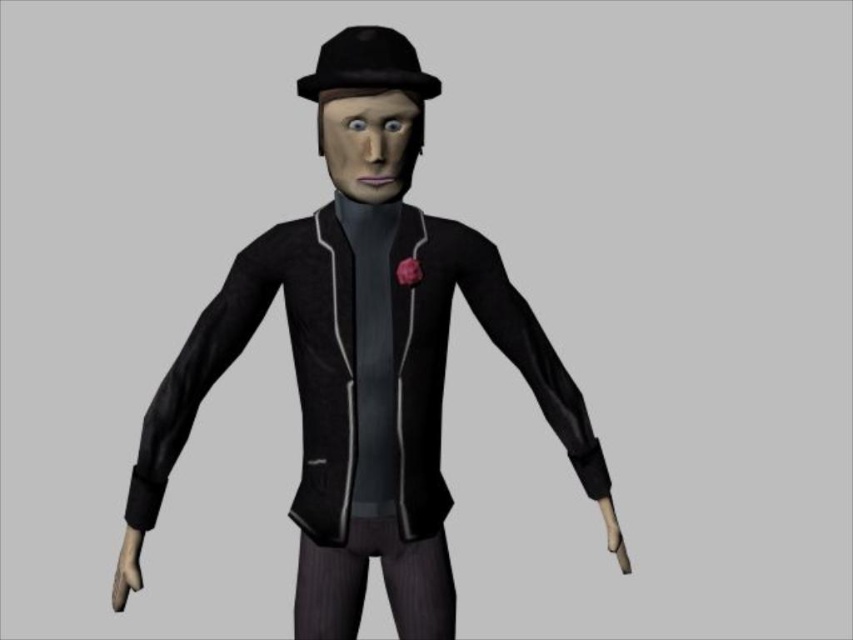
Question: Is matte black jacket at center smaller than black matte fedora at center?

Choices:
 (A) no
 (B) yes

Answer: (A)

Question: Is matte black jacket at center wider than black matte fedora at center?

Choices:
 (A) no
 (B) yes

Answer: (B)

Question: Among these points, which one is farthest from the camera?

Choices:
 (A) (352, 38)
 (B) (300, 588)

Answer: (B)

Question: Does matte black jacket at center have a greater width compared to black matte fedora at center?

Choices:
 (A) no
 (B) yes

Answer: (B)